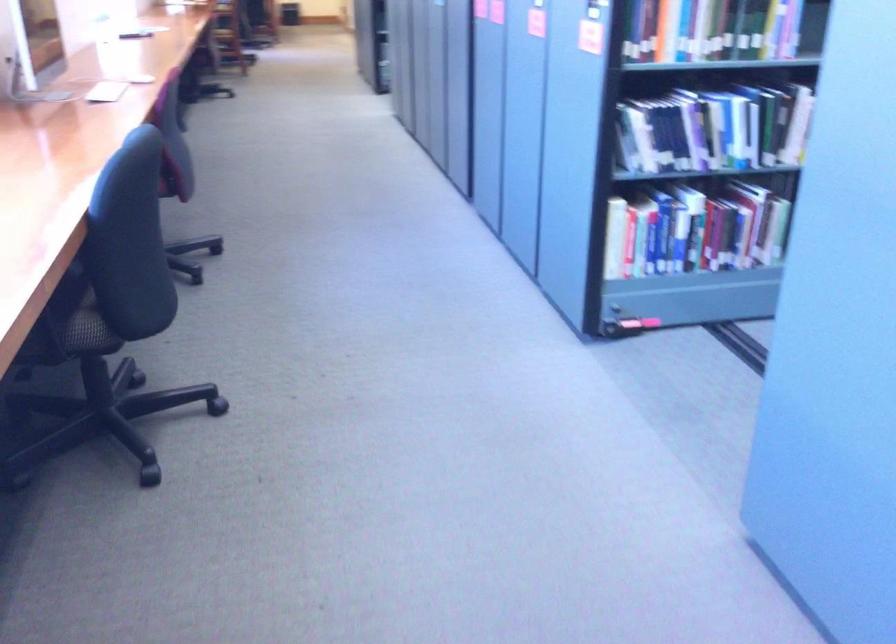
Image resolution: width=896 pixels, height=644 pixels. I want to click on purple spine book, so click(x=695, y=129).